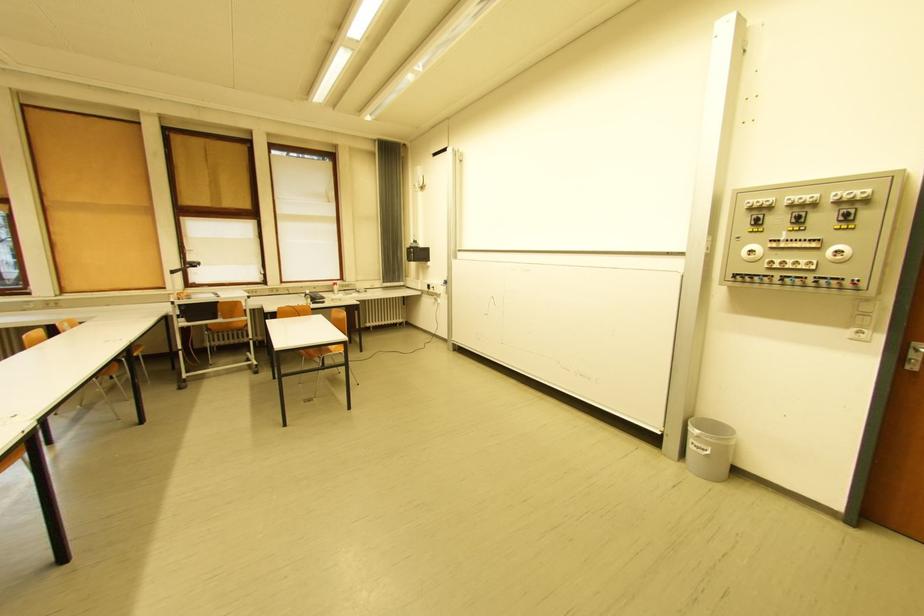
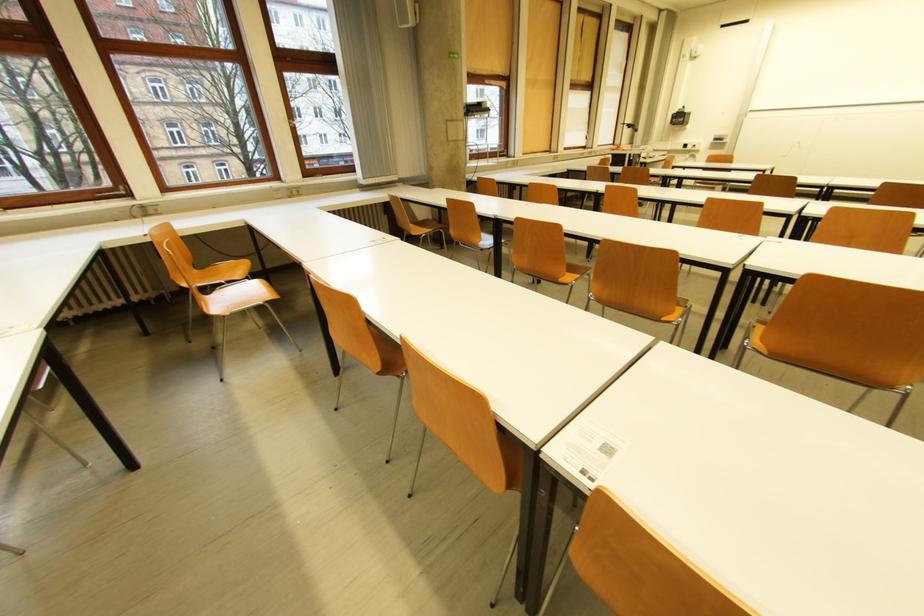
In the second image, find the point that corresponds to the point at 435,288 in the first image.

(691, 147)